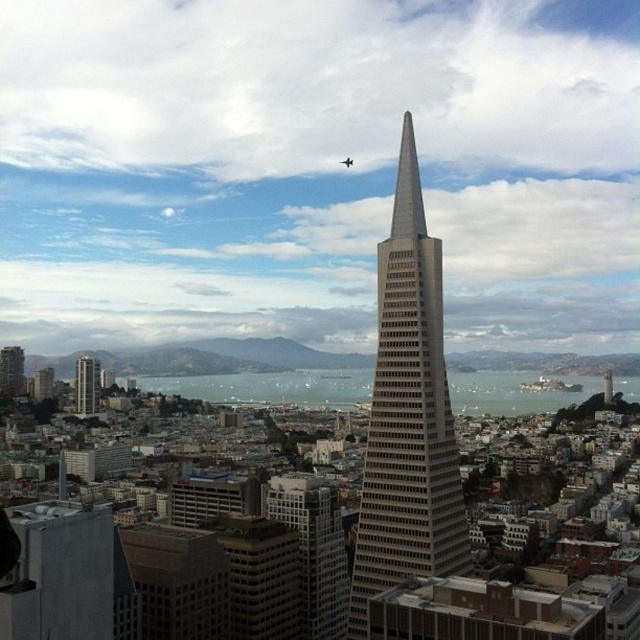
You are an architect analyzing the city layout. Based on the scene, which object is wider between the gray concrete skyscraper at center and the gray concrete building at left?

The gray concrete skyscraper at center might be wider than the gray concrete building at left according to the description.

You are standing in the city and looking at the gray concrete building at left and the matte gray building at left. Which one is closer to the ground?

The gray concrete building at left is positioned under the matte gray building at left, so it is closer to the ground.

You are a city planner analyzing the skyline. Which of the two gray concrete structures, the gray concrete skyscraper at center or the gray concrete building at left, would cast a longer shadow during midday in summer?

The gray concrete skyscraper at center is larger than the gray concrete building at left, so it would cast a longer shadow during midday in summer.